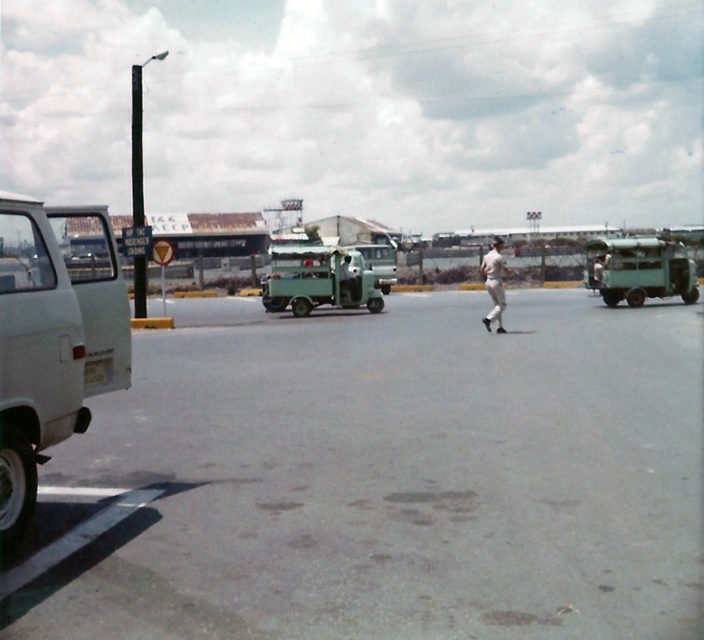
Which is below, gray asphalt parking lot at center or white fabric baseball cap at center?

Positioned lower is gray asphalt parking lot at center.

Is point (325, 564) positioned behind point (502, 292)?

No, (325, 564) is closer to viewer.

Find the location of a particular element. The height and width of the screenshot is (640, 704). gray asphalt parking lot at center is located at coordinates (382, 477).

Does gray asphalt parking lot at center have a lesser width compared to green matte truck at right?

No.

Who is positioned more to the left, gray asphalt parking lot at center or green matte truck at right?

gray asphalt parking lot at center is more to the left.

Between point (498, 422) and point (622, 294), which one is positioned behind?

The point (622, 294) is behind.

Find the location of a particular element. gray asphalt parking lot at center is located at coordinates (382, 477).

Image resolution: width=704 pixels, height=640 pixels. Describe the element at coordinates (50, 346) in the screenshot. I see `white matte van at left` at that location.

Who is positioned more to the right, white matte van at left or green matte truck at center?

Positioned to the right is green matte truck at center.

Who is more distant from viewer, (25, 474) or (272, 307)?

Positioned behind is point (272, 307).

Where is `white matte van at left`? white matte van at left is located at coordinates (50, 346).